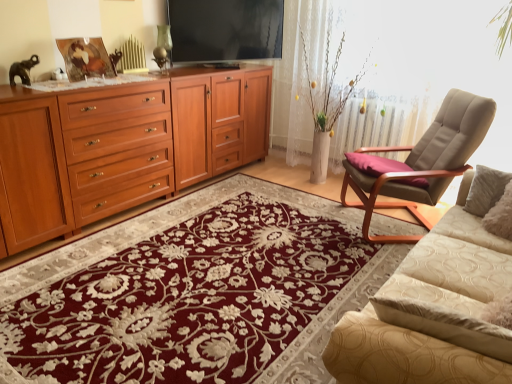
Identify the location of free space to the left of beige fabric chair at right. Image resolution: width=512 pixels, height=384 pixels. (312, 227).